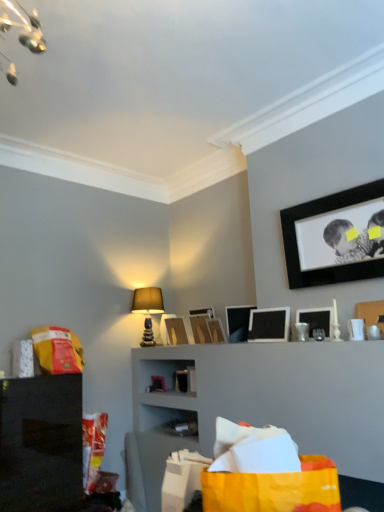
Question: Is wooden picture frame at center, acting as the fifth picture frame starting from the back, completely or partially outside of black glossy cabinet at lower left?

Choices:
 (A) no
 (B) yes

Answer: (B)

Question: From the image's perspective, is wooden picture frame at center, acting as the fifth picture frame starting from the back, over black glossy cabinet at lower left?

Choices:
 (A) no
 (B) yes

Answer: (B)

Question: Considering the relative sizes of wooden picture frame at center, arranged as the fourth picture frame when viewed from the front, and black glossy cabinet at lower left in the image provided, is wooden picture frame at center, arranged as the fourth picture frame when viewed from the front, smaller than black glossy cabinet at lower left?

Choices:
 (A) yes
 (B) no

Answer: (A)

Question: From a real-world perspective, is wooden picture frame at center, acting as the fifth picture frame starting from the back, under black glossy cabinet at lower left?

Choices:
 (A) no
 (B) yes

Answer: (A)

Question: From a real-world perspective, is wooden picture frame at center, arranged as the fourth picture frame when viewed from the front, on black glossy cabinet at lower left?

Choices:
 (A) no
 (B) yes

Answer: (B)

Question: Considering the relative sizes of wooden picture frame at center, arranged as the fourth picture frame when viewed from the front, and black glossy cabinet at lower left in the image provided, is wooden picture frame at center, arranged as the fourth picture frame when viewed from the front, shorter than black glossy cabinet at lower left?

Choices:
 (A) no
 (B) yes

Answer: (B)

Question: From the image's perspective, is wooden picture frame at center, positioned as the 6th picture frame in front-to-back order, below black matte picture frame at upper right, which is counted as the first picture frame, starting from the front?

Choices:
 (A) yes
 (B) no

Answer: (A)

Question: Is black matte picture frame at upper right, which is counted as the first picture frame, starting from the front, a part of wooden picture frame at center, the 3th picture frame positioned from the back?

Choices:
 (A) no
 (B) yes

Answer: (A)

Question: Does wooden picture frame at center, the 3th picture frame positioned from the back, have a greater width compared to black matte picture frame at upper right, which is counted as the first picture frame, starting from the front?

Choices:
 (A) no
 (B) yes

Answer: (B)

Question: Does wooden picture frame at center, positioned as the 6th picture frame in front-to-back order, have a greater height compared to black matte picture frame at upper right, which is counted as the first picture frame, starting from the front?

Choices:
 (A) no
 (B) yes

Answer: (A)

Question: From the image's perspective, would you say wooden picture frame at center, the 3th picture frame positioned from the back, is positioned over black matte picture frame at upper right, which appears as the eighth picture frame when viewed from the back?

Choices:
 (A) yes
 (B) no

Answer: (B)

Question: Are wooden picture frame at center, the 3th picture frame positioned from the back, and black matte picture frame at upper right, which is counted as the first picture frame, starting from the front, beside each other?

Choices:
 (A) no
 (B) yes

Answer: (A)

Question: Is matte black picture frame at upper right, which is the 3th picture frame from front to back, thinner than matte black picture frame at upper right, the seventh picture frame when ordered from back to front?

Choices:
 (A) yes
 (B) no

Answer: (B)